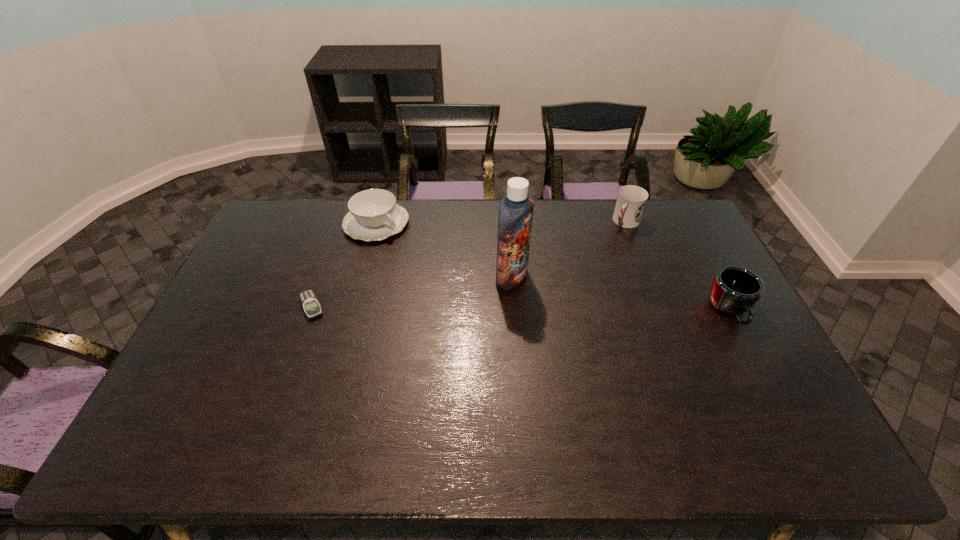
The image size is (960, 540). Identify the location of beeper. (311, 306).

The width and height of the screenshot is (960, 540). In order to click on mug in this screenshot , I will do `click(734, 290)`.

I want to click on chinaware, so click(374, 214).

You are a GUI agent. You are given a task and a screenshot of the screen. Output one action in this format:
    pyautogui.click(x=<x>, y=<y>)
    Task: Click on the third object from left to right
    This screenshot has width=960, height=540.
    Given the screenshot: What is the action you would take?
    pyautogui.click(x=515, y=215)

Find the location of a particular element. This screenshot has width=960, height=540. the tallest object is located at coordinates (515, 215).

Identify the location of cup. This screenshot has width=960, height=540. (631, 201).

This screenshot has width=960, height=540. Identify the location of free spot located 0.250m on the front of the beeper. (279, 397).

You are a GUI agent. You are given a task and a screenshot of the screen. Output one action in this format:
    pyautogui.click(x=<x>, y=<y>)
    Task: Click on the vacant space located on the side of the rightmost object with the handle
    Image resolution: width=960 pixels, height=540 pixels.
    Given the screenshot: What is the action you would take?
    pyautogui.click(x=764, y=376)

At what (x,y) coordinates should I click in order to perform the action: click on free space located 0.090m on the handle side of the chinaware. Please return your answer as a coordinate pair (x, y). The width and height of the screenshot is (960, 540). Looking at the image, I should click on (412, 251).

This screenshot has height=540, width=960. Find the location of `vacant area situated on the handle side of the chinaware`. vacant area situated on the handle side of the chinaware is located at coordinates (468, 295).